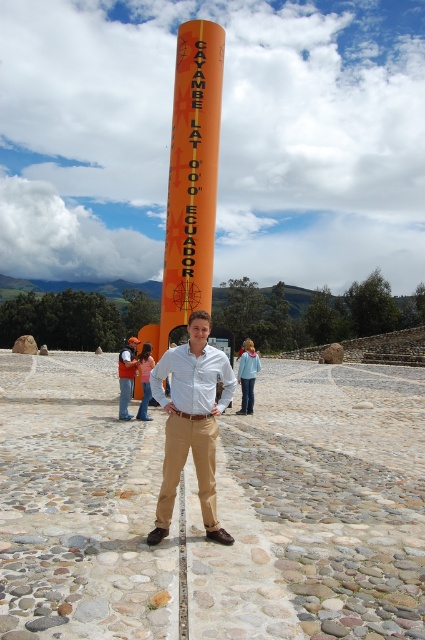
Question: Is the position of matte khaki pants at center less distant than that of orange vinyl pole at center?

Choices:
 (A) no
 (B) yes

Answer: (B)

Question: Which of the following is the farthest from the observer?

Choices:
 (A) matte white shirt at center
 (B) orange matte pole at center
 (C) matte khaki pants at center
 (D) orange vinyl pole at center

Answer: (D)

Question: Which of these objects is positioned closest to the matte white shirt at center?

Choices:
 (A) orange vinyl pole at center
 (B) matte khaki pants at center

Answer: (A)

Question: Does orange vinyl pole at center come in front of matte white shirt at center?

Choices:
 (A) no
 (B) yes

Answer: (A)

Question: Can you confirm if matte khaki pants at center is smaller than matte white shirt at center?

Choices:
 (A) no
 (B) yes

Answer: (B)

Question: Which point is closer to the camera?

Choices:
 (A) matte khaki pants at center
 (B) orange vinyl pole at center
 (C) orange matte pole at center
 (D) matte white shirt at center

Answer: (A)